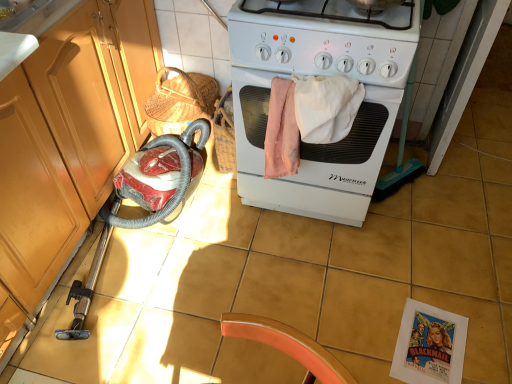
Question: Is matte wood cabinet at left to the left of white matte stove at center from the viewer's perspective?

Choices:
 (A) yes
 (B) no

Answer: (A)

Question: Does matte wood cabinet at left have a greater width compared to white matte stove at center?

Choices:
 (A) yes
 (B) no

Answer: (A)

Question: Is matte wood cabinet at left next to white matte stove at center?

Choices:
 (A) yes
 (B) no

Answer: (B)

Question: Does matte wood cabinet at left have a greater height compared to white matte stove at center?

Choices:
 (A) no
 (B) yes

Answer: (A)

Question: Would you consider matte wood cabinet at left to be distant from white matte stove at center?

Choices:
 (A) no
 (B) yes

Answer: (A)

Question: Considering the relative sizes of matte wood cabinet at left and white matte stove at center in the image provided, is matte wood cabinet at left thinner than white matte stove at center?

Choices:
 (A) yes
 (B) no

Answer: (B)

Question: Considering the relative sizes of matte wood cabinet at left and white glossy gas stove at center in the image provided, is matte wood cabinet at left shorter than white glossy gas stove at center?

Choices:
 (A) yes
 (B) no

Answer: (B)

Question: Is matte wood cabinet at left closer to the viewer compared to white glossy gas stove at center?

Choices:
 (A) no
 (B) yes

Answer: (A)

Question: Is matte wood cabinet at left turned away from white glossy gas stove at center?

Choices:
 (A) no
 (B) yes

Answer: (A)

Question: Would you say matte wood cabinet at left is a long distance from white glossy gas stove at center?

Choices:
 (A) no
 (B) yes

Answer: (A)

Question: Is matte wood cabinet at left placed right next to white glossy gas stove at center?

Choices:
 (A) yes
 (B) no

Answer: (B)

Question: From a real-world perspective, is matte wood cabinet at left physically above white glossy gas stove at center?

Choices:
 (A) no
 (B) yes

Answer: (A)

Question: Is white glossy gas stove at center positioned far away from white matte stove at center?

Choices:
 (A) yes
 (B) no

Answer: (B)